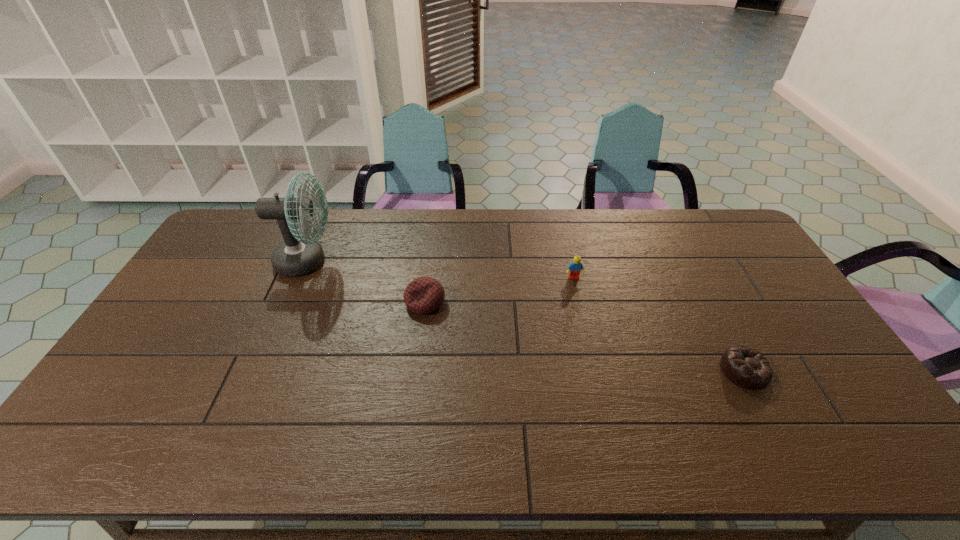
Where is `vacant region between the rightmost object and the left beanbag`? This screenshot has width=960, height=540. vacant region between the rightmost object and the left beanbag is located at coordinates (585, 336).

Select which object appears as the third closest to the fan. Please provide its 2D coordinates. Your answer should be formatted as a tuple, i.e. [(x, y)], where the tuple contains the x and y coordinates of a point satisfying the conditions above.

[(745, 367)]

Locate an element on the screen. This screenshot has width=960, height=540. object that ranks as the second closest to the nearest object is located at coordinates (423, 295).

The height and width of the screenshot is (540, 960). I want to click on free space that satisfies the following two spatial constraints: 1. on the face of the nearer beanbag; 2. on the left side of the Lego, so [x=595, y=370].

Where is `free location that satisfies the following two spatial constraints: 1. on the face of the Lego; 2. on the right side of the nearest object`? free location that satisfies the following two spatial constraints: 1. on the face of the Lego; 2. on the right side of the nearest object is located at coordinates (595, 370).

Locate an element on the screen. free space that satisfies the following two spatial constraints: 1. on the front side of the right beanbag; 2. on the right side of the farther beanbag is located at coordinates (417, 370).

Find the location of a particular element. The image size is (960, 540). free space that satisfies the following two spatial constraints: 1. in front of the leftmost object where the airflow is directed; 2. on the left side of the shortest object is located at coordinates (259, 370).

You are a GUI agent. You are given a task and a screenshot of the screen. Output one action in this format:
    pyautogui.click(x=<x>, y=<y>)
    Task: Click on the vacant space that satisfies the following two spatial constraints: 1. in front of the tallest object where the airflow is directed; 2. on the left side of the right beanbag
    
    Given the screenshot: What is the action you would take?
    pyautogui.click(x=259, y=370)

What are the coordinates of `free location that satisfies the following two spatial constraints: 1. in front of the right beanbag where the airflow is directed; 2. on the left side of the fan` in the screenshot? It's located at (259, 370).